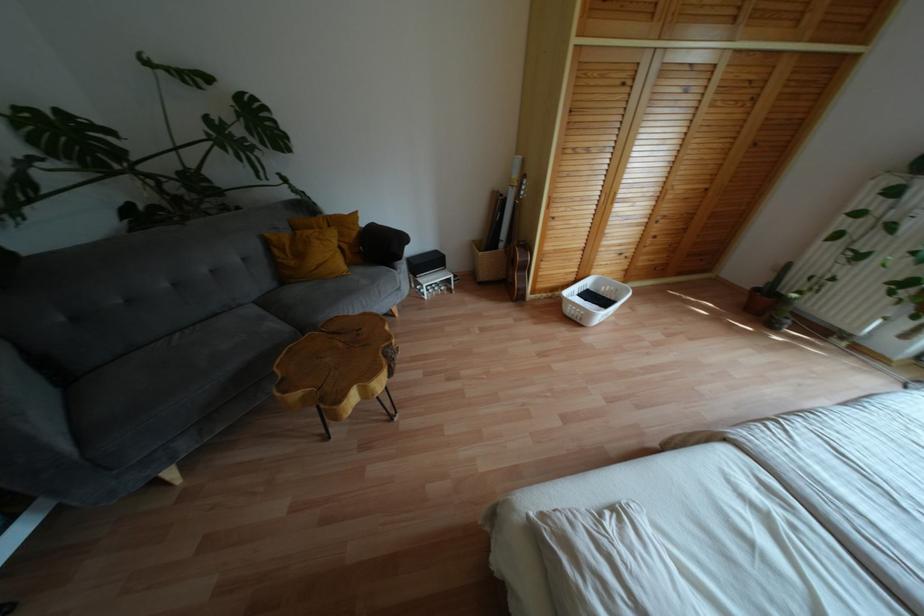
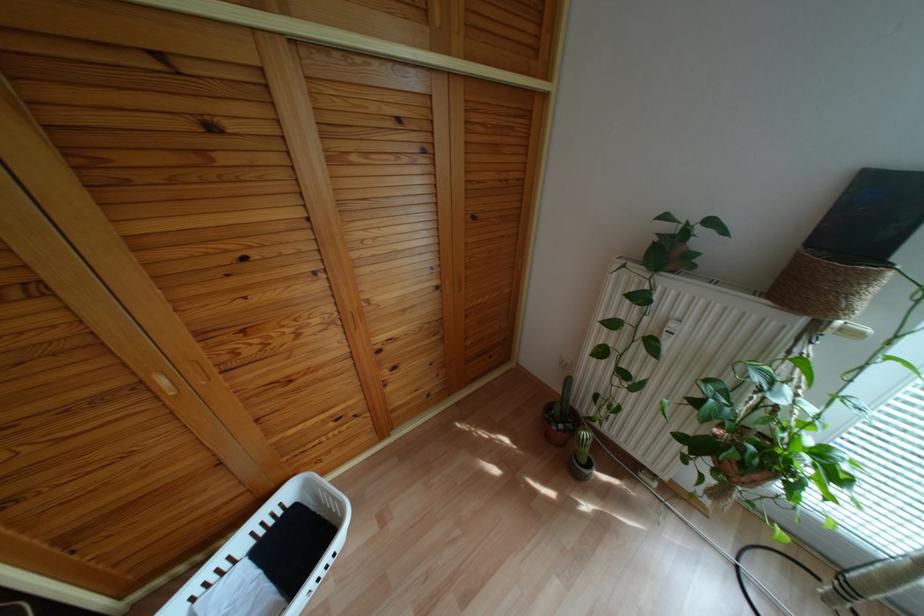
What movement of the cameraman would produce the second image?

The movement direction of the cameraman is right, forward.